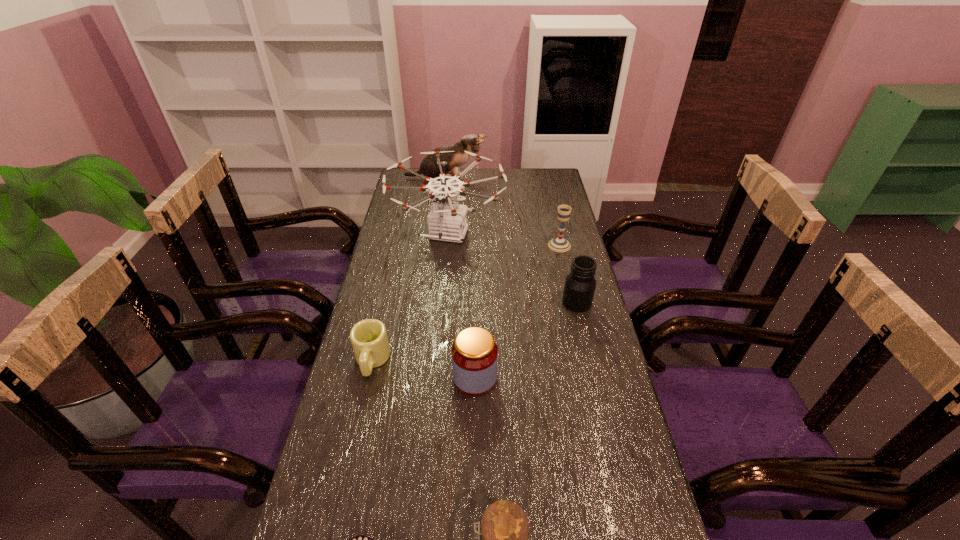
Identify the location of drone. Image resolution: width=960 pixels, height=540 pixels. (447, 221).

Locate an element on the screen. the seventh shortest object is located at coordinates (471, 143).

Identify the location of cat. (471, 143).

Where is `the rightmost jar`? the rightmost jar is located at coordinates (580, 284).

Locate an element on the screen. The image size is (960, 540). the fifth nearest object is located at coordinates (580, 284).

Where is `chalice`? chalice is located at coordinates (559, 244).

You are a GUI agent. You are given a task and a screenshot of the screen. Output one action in this format:
    pyautogui.click(x=<x>, y=<y>)
    Task: Click on the second farthest jar
    This screenshot has width=960, height=540.
    Given the screenshot: What is the action you would take?
    coord(474,353)

Identify the location of mug. The width and height of the screenshot is (960, 540). (369, 340).

Where is `free space located 0.140m on the right of the drone`? Image resolution: width=960 pixels, height=540 pixels. free space located 0.140m on the right of the drone is located at coordinates (541, 234).

I want to click on vacant space located 0.150m at the face of the cat, so click(x=519, y=178).